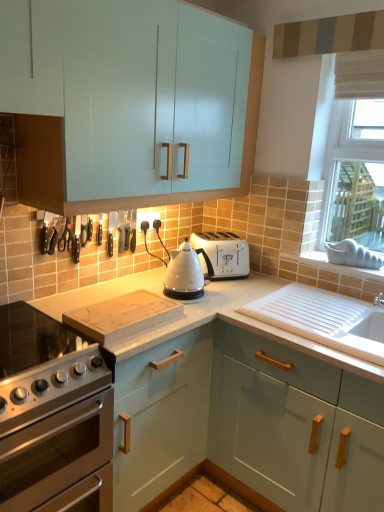
Where is `free space in front of white glossy kettle at center`? This screenshot has width=384, height=512. free space in front of white glossy kettle at center is located at coordinates (200, 311).